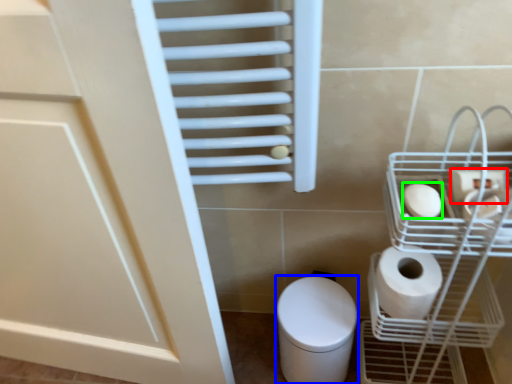
Question: Based on their relative distances, which object is farther from toilet paper (highlighted by a red box)? Choose from bidet (highlighted by a blue box) and toilet paper (highlighted by a green box).

Choices:
 (A) bidet
 (B) toilet paper

Answer: (A)